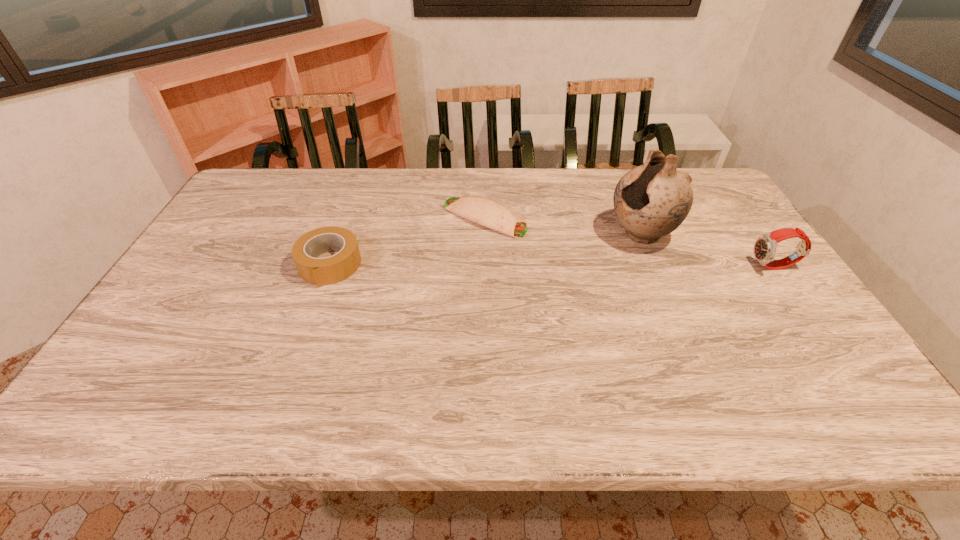
The image size is (960, 540). What are the coordinates of `vacant area that satisfies the following two spatial constraints: 1. at the edge of the leftmost object; 2. on the face of the watch` in the screenshot? It's located at (329, 267).

Locate an element on the screen. This screenshot has width=960, height=540. free spot that satisfies the following two spatial constraints: 1. at the edge of the watch; 2. on the face of the leftmost object is located at coordinates (329, 267).

Where is `free space that satisfies the following two spatial constraints: 1. on the front side of the watch; 2. on the face of the shortest object`? The image size is (960, 540). free space that satisfies the following two spatial constraints: 1. on the front side of the watch; 2. on the face of the shortest object is located at coordinates (485, 267).